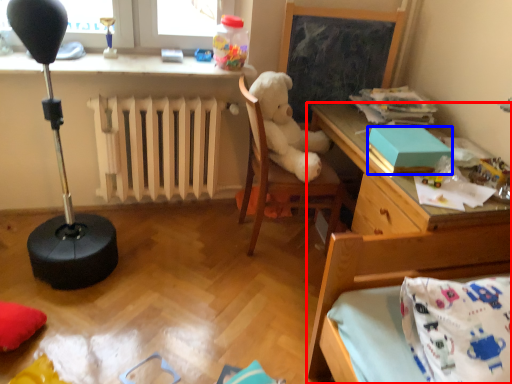
Question: Which object is further to the camera taking this photo, desk (highlighted by a red box) or box (highlighted by a blue box)?

Choices:
 (A) desk
 (B) box

Answer: (B)